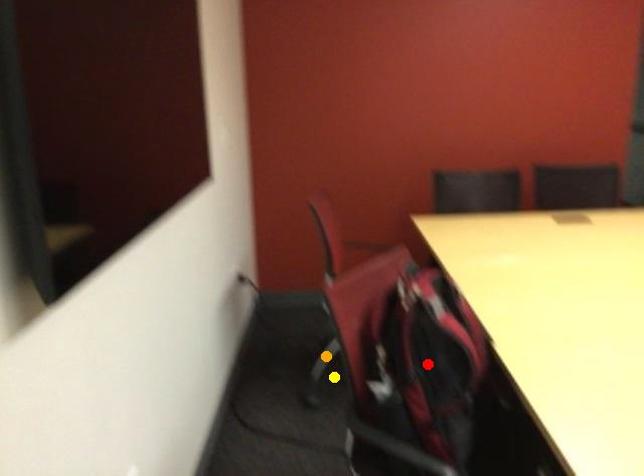
Order these from farthest to nearest:
orange point, yellow point, red point

orange point < yellow point < red point